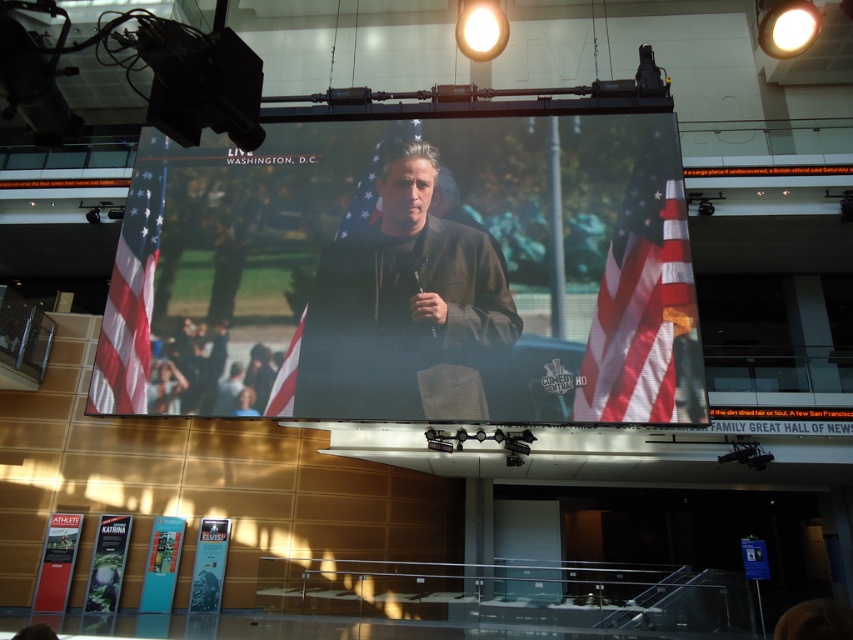
You are a photographer standing in the convention center and want to take a photo that includes both the brown leather jacket at center and the matte american flag at right. Based on their positions, which object should you place on the left side of your photo?

The brown leather jacket at center should be placed on the left side of your photo because it is positioned on the left side of the matte american flag at right.

Consider the image. You are an event organizer setting up a stage for a presentation. You have a matte black screen at center and a matte american flag at right. Based on the scene description, which object is located to the left of the other?

The matte black screen at center is positioned on the left side of the matte american flag at right, so the screen is to the left of the flag.

You are organizing a photo shoot in the convention center and need to position the brown leather jacket at center and the matte american flag at right. The flag must be placed to the right of the jacket. Can the flag be positioned to the right of the jacket without overlapping?

The brown leather jacket at center might be wider than matte american flag at right, so there is a possibility that the flag could be positioned to the right of the jacket without overlapping, but it depends on the exact width measurements. Ensure there is sufficient space between them to avoid overlap.